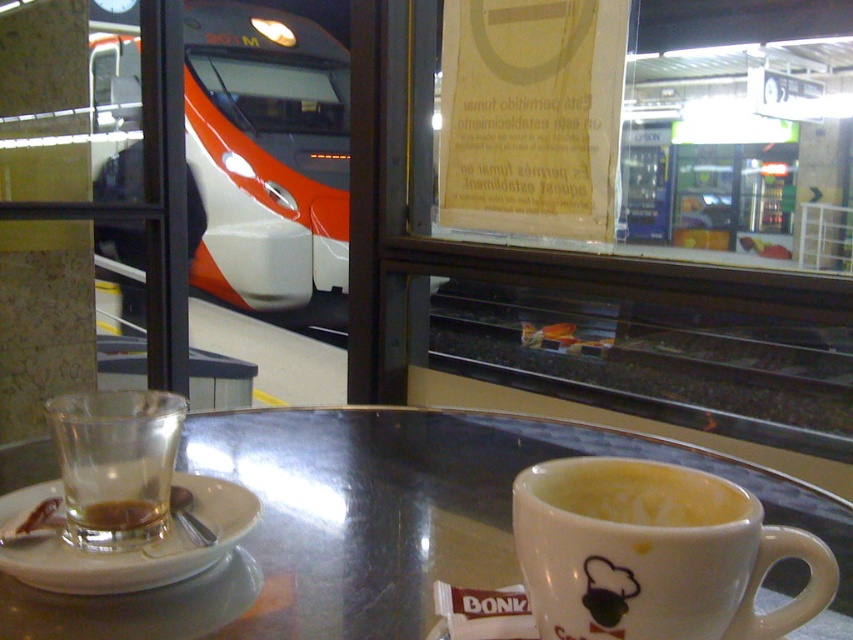
You are a barista who needs to place a new sugar packet between the translucent glass at table left and the white ceramic saucer at left. Is there enough space to fit it without moving either item?

The distance between the translucent glass at table left and the white ceramic saucer at left is 1.64 inches. Since a standard sugar packet is approximately 1.5 inches wide, there is just enough space to fit it between them without moving either item.

You are a barista preparing a drink and need to place the translucent glass cup at lower left on the white ceramic saucer at left. Will the cup fit on the saucer without overhanging?

The white ceramic saucer at left has a larger size compared to the translucent glass cup at lower left, so the cup will fit on the saucer without overhanging.